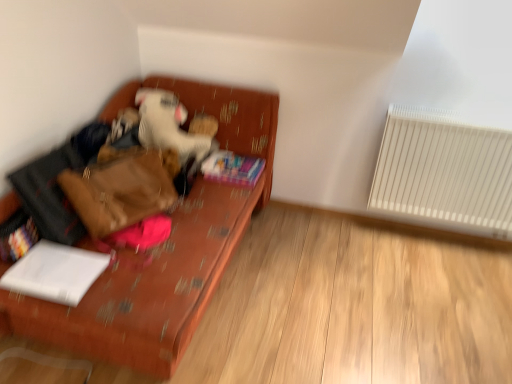
Question: Is white plastic radiator at right thinner than multicolored plastic book at lower left, which is the second book from bottom to top?

Choices:
 (A) yes
 (B) no

Answer: (A)

Question: From a real-world perspective, is white plastic radiator at right physically below multicolored plastic book at lower left, which is the 3th book from right to left?

Choices:
 (A) yes
 (B) no

Answer: (B)

Question: From the image's perspective, is white plastic radiator at right above multicolored plastic book at lower left, which is the 3th book from right to left?

Choices:
 (A) yes
 (B) no

Answer: (A)

Question: Does white plastic radiator at right have a lesser height compared to multicolored plastic book at lower left, which ranks as the second book in front-to-back order?

Choices:
 (A) yes
 (B) no

Answer: (B)

Question: Does white plastic radiator at right touch multicolored plastic book at lower left, the first book viewed from the left?

Choices:
 (A) no
 (B) yes

Answer: (A)

Question: Is white plastic radiator at right taller or shorter than multicolored plastic book at lower left, which is the second book from bottom to top?

Choices:
 (A) tall
 (B) short

Answer: (A)

Question: Is point (424, 177) positioned closer to the camera than point (26, 228)?

Choices:
 (A) closer
 (B) farther

Answer: (B)

Question: From a real-world perspective, relative to multicolored plastic book at lower left, the first book viewed from the left, is white plastic radiator at right vertically above or below?

Choices:
 (A) above
 (B) below

Answer: (A)

Question: Is white plastic radiator at right situated inside multicolored plastic book at lower left, the first book viewed from the left, or outside?

Choices:
 (A) outside
 (B) inside

Answer: (A)

Question: Is textured orange couch at left spatially inside white plastic radiator at right, or outside of it?

Choices:
 (A) inside
 (B) outside

Answer: (B)

Question: From the image's perspective, is textured orange couch at left positioned above or below white plastic radiator at right?

Choices:
 (A) below
 (B) above

Answer: (A)

Question: From a real-world perspective, is textured orange couch at left physically located above or below white plastic radiator at right?

Choices:
 (A) above
 (B) below

Answer: (B)

Question: Considering the relative positions of textured orange couch at left and white plastic radiator at right in the image provided, is textured orange couch at left to the left or to the right of white plastic radiator at right?

Choices:
 (A) right
 (B) left

Answer: (B)

Question: Is multicolored plastic book at lower left, which is the 3th book from right to left, taller or shorter than white plush toy at center?

Choices:
 (A) short
 (B) tall

Answer: (A)

Question: From a real-world perspective, is multicolored plastic book at lower left, which is the 3th book from right to left, above or below white plush toy at center?

Choices:
 (A) above
 (B) below

Answer: (B)